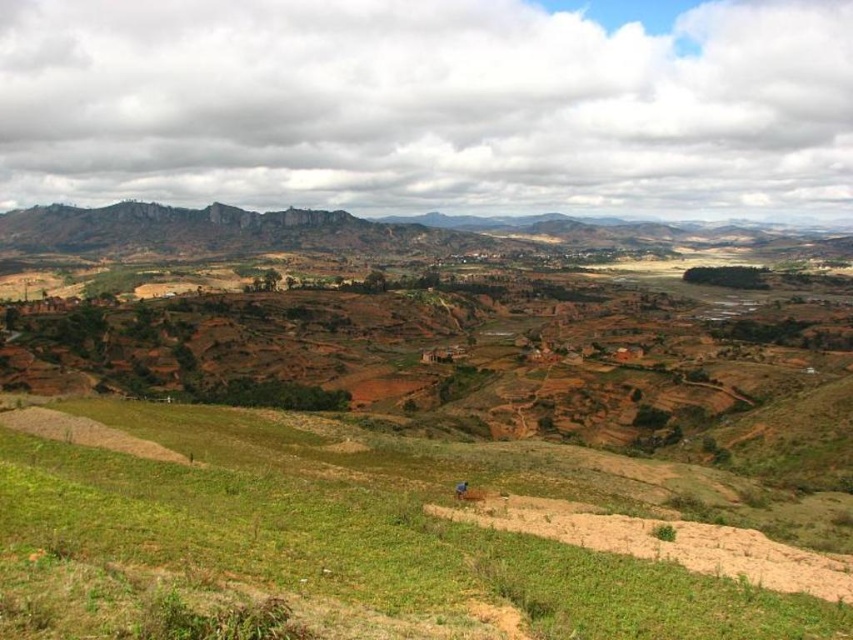
Is green grassy field at lower center shorter than blue fabric person at center?

No, green grassy field at lower center is not shorter than blue fabric person at center.

Does green grassy field at lower center have a greater height compared to blue fabric person at center?

Indeed, green grassy field at lower center has a greater height compared to blue fabric person at center.

Is point (375, 525) in front of point (460, 484)?

Yes, it is.

You are a GUI agent. You are given a task and a screenshot of the screen. Output one action in this format:
    pyautogui.click(x=<x>, y=<y>)
    Task: Click on the green grassy field at lower center
    The height and width of the screenshot is (640, 853).
    Given the screenshot: What is the action you would take?
    pyautogui.click(x=332, y=538)